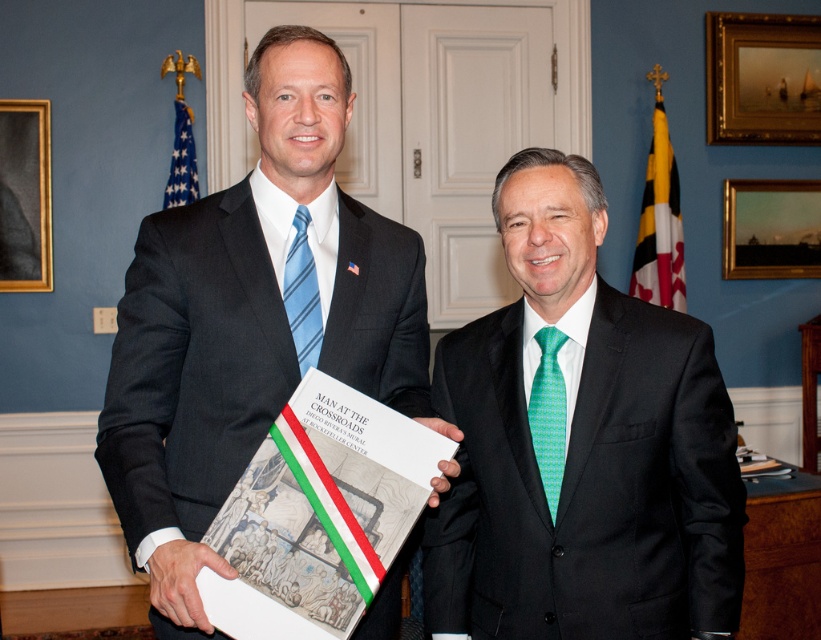
Question: Does gold-framed painting at upper right appear on the left side of gold wooden picture frame at upper right?

Choices:
 (A) yes
 (B) no

Answer: (A)

Question: Estimate the real-world distances between objects in this image. Which object is closer to the black suit at center?

Choices:
 (A) green textured tie at center
 (B) gold wooden picture frame at upper right
 (C) gold wooden picture frame at upper left
 (D) green textured tie at right

Answer: (A)

Question: Can you confirm if green textured tie at center is positioned to the right of black suit at center?

Choices:
 (A) yes
 (B) no

Answer: (A)

Question: Does gold wooden picture frame at upper right come behind blue striped tie at left?

Choices:
 (A) no
 (B) yes

Answer: (B)

Question: Considering the real-world distances, which object is closest to the gold-framed painting at upper right?

Choices:
 (A) green textured tie at center
 (B) green textured tie at right
 (C) black suit at center

Answer: (A)

Question: Which is nearer to the green textured tie at center?

Choices:
 (A) gold wooden picture frame at upper right
 (B) blue striped tie at left
 (C) green textured tie at right

Answer: (C)